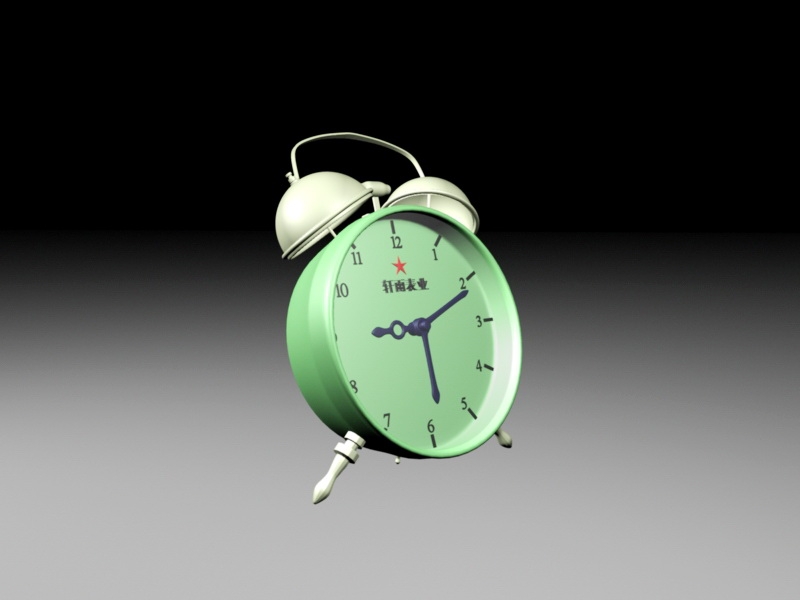
The width and height of the screenshot is (800, 600). I want to click on green face of alarm clock, so 392,360.